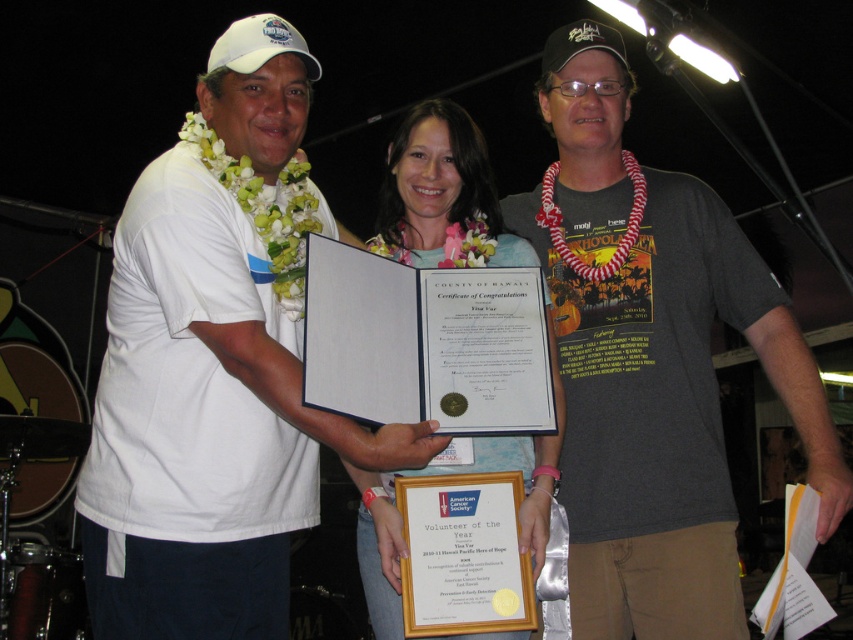
Question: Among these points, which one is nearest to the camera?

Choices:
 (A) pyautogui.click(x=631, y=314)
 (B) pyautogui.click(x=560, y=387)
 (C) pyautogui.click(x=119, y=298)

Answer: (C)

Question: Does white matte t-shirt at left come behind white paper certificate at center?

Choices:
 (A) yes
 (B) no

Answer: (B)

Question: Does white matte t-shirt at left appear over gray cotton t-shirt at center?

Choices:
 (A) yes
 (B) no

Answer: (B)

Question: Does white matte t-shirt at left have a greater width compared to gray cotton t-shirt at center?

Choices:
 (A) yes
 (B) no

Answer: (A)

Question: Based on their relative distances, which object is farther from the white paper certificate at center?

Choices:
 (A) white matte t-shirt at left
 (B) gray cotton t-shirt at center

Answer: (A)

Question: Which object appears closest to the camera in this image?

Choices:
 (A) white matte t-shirt at left
 (B) white paper certificate at center
 (C) gray cotton t-shirt at center

Answer: (A)